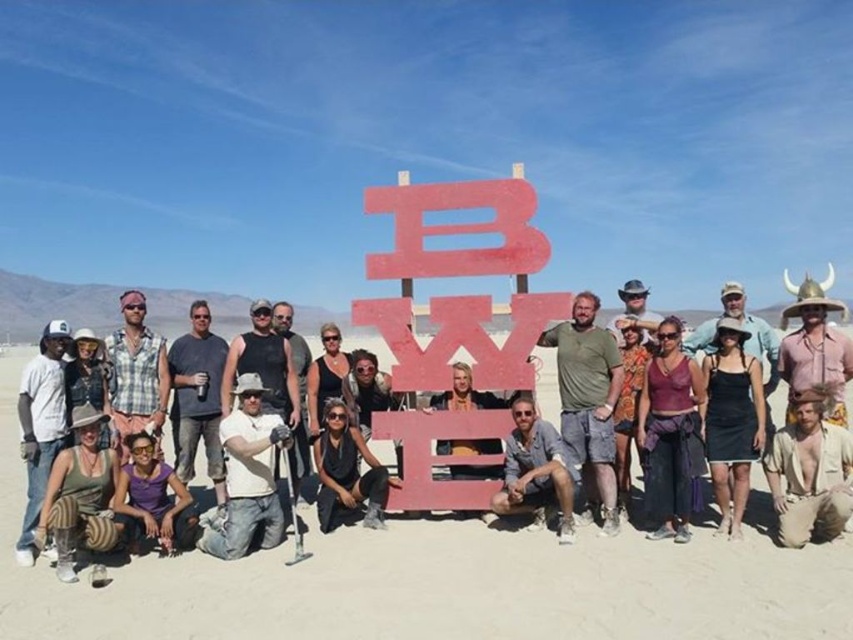
Question: In this image, where is purple fabric skirt at lower center located relative to green fabric pants at lower left?

Choices:
 (A) left
 (B) right

Answer: (B)

Question: Does matte concrete sign at center appear on the right side of purple fabric skirt at lower center?

Choices:
 (A) yes
 (B) no

Answer: (B)

Question: Which object is closer to the camera taking this photo?

Choices:
 (A) purple matte shirt at lower left
 (B) black fabric dress at lower right

Answer: (A)

Question: Observing the image, what is the correct spatial positioning of green matte shirt at center in reference to purple matte shirt at lower left?

Choices:
 (A) left
 (B) right

Answer: (B)

Question: Among these points, which one is nearest to the camera?

Choices:
 (A) (113, 332)
 (B) (199, 397)

Answer: (B)

Question: Based on their relative distances, which object is farther from the green fabric pants at lower left?

Choices:
 (A) red painted wood sign at center
 (B) black matte dress at center
 (C) green matte shirt at center

Answer: (C)